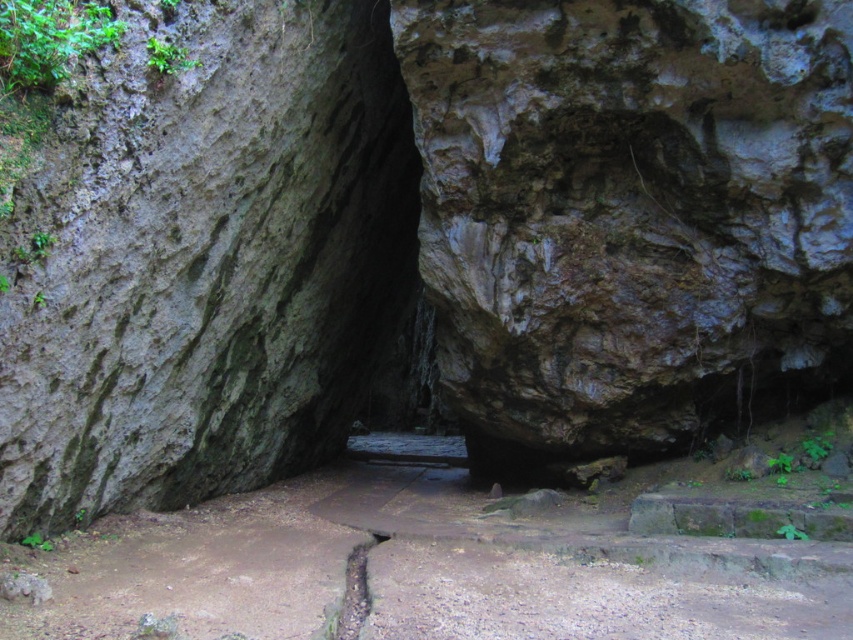
You are standing at the entrance of the cave and notice a brown rough rock at center. Can you determine its exact location based on the coordinates provided?

The brown rough rock at center is located at point [628,211], which means it is positioned one third from the left and three quarters down from the top of the image.